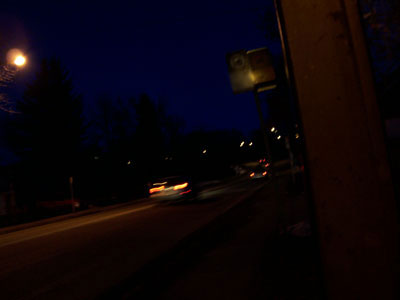
This screenshot has width=400, height=300. What are the coordinates of `white lights in the back ground` in the screenshot? It's located at (280, 139), (272, 128), (250, 141), (242, 140), (206, 147), (168, 157), (130, 162), (96, 156), (297, 135).